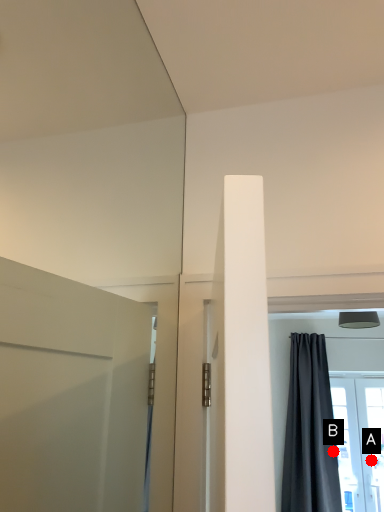
Question: Two points are circled on the image, labeled by A and B beside each circle. Among these points, which one is nearest to the camera?

Choices:
 (A) A is closer
 (B) B is closer

Answer: (B)